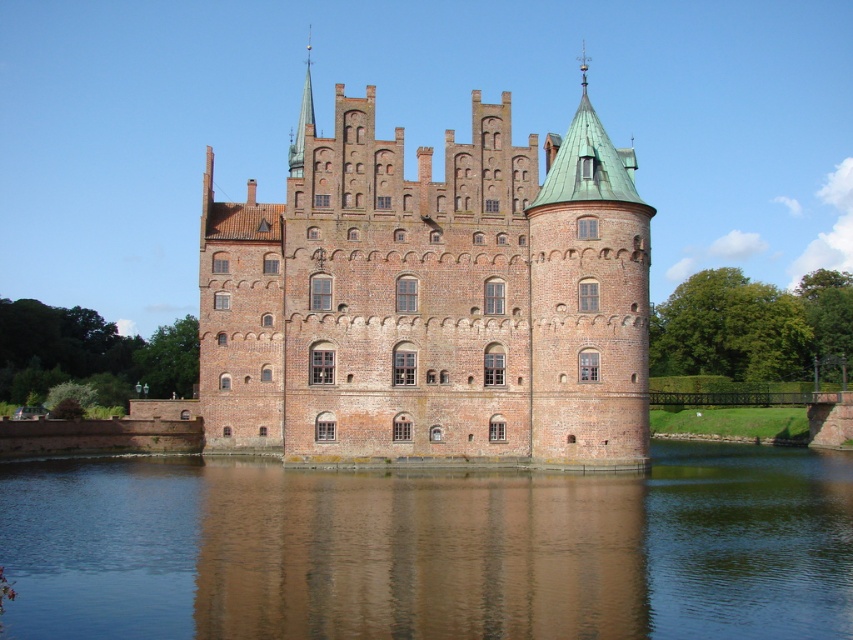
Question: Which of the following is the farthest from the observer?

Choices:
 (A) brown reflective water at center
 (B) brown brick castle at center

Answer: (B)

Question: Does brown reflective water at center have a greater width compared to brown brick castle at center?

Choices:
 (A) no
 (B) yes

Answer: (B)

Question: Which point is farther to the camera?

Choices:
 (A) (552, 308)
 (B) (648, 602)

Answer: (A)

Question: Which object appears farthest from the camera in this image?

Choices:
 (A) brown reflective water at center
 (B) brown brick castle at center

Answer: (B)

Question: Is brown reflective water at center smaller than brown brick castle at center?

Choices:
 (A) yes
 (B) no

Answer: (A)

Question: Does brown reflective water at center have a greater width compared to brown brick castle at center?

Choices:
 (A) no
 (B) yes

Answer: (B)